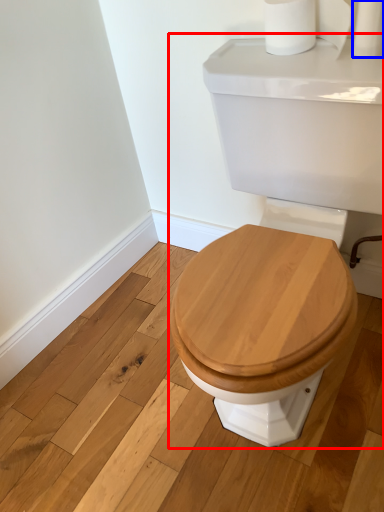
Question: Among these objects, which one is farthest to the camera, porcelain (highlighted by a red box) or toilet paper (highlighted by a blue box)?

Choices:
 (A) porcelain
 (B) toilet paper

Answer: (B)